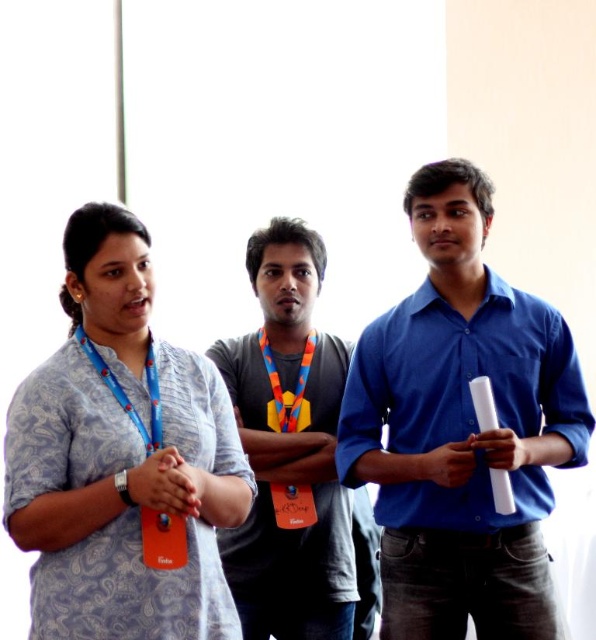
You are organizing a conference and need to determine which lanyard is narrower for a name tag. Which one between the multicolored fabric lanyard at center and the orange fabric at center is narrower?

The multicolored fabric lanyard at center is narrower than the orange fabric at center.